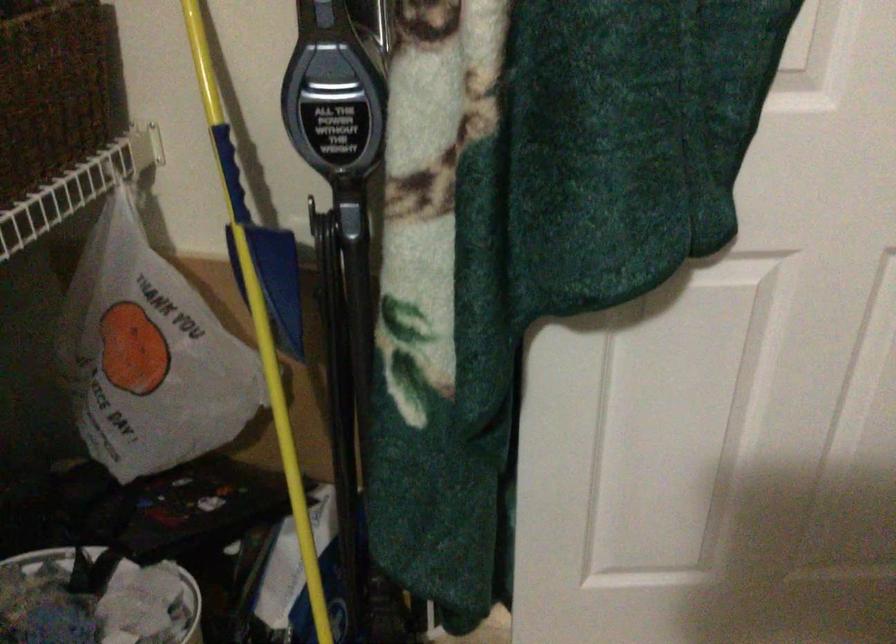
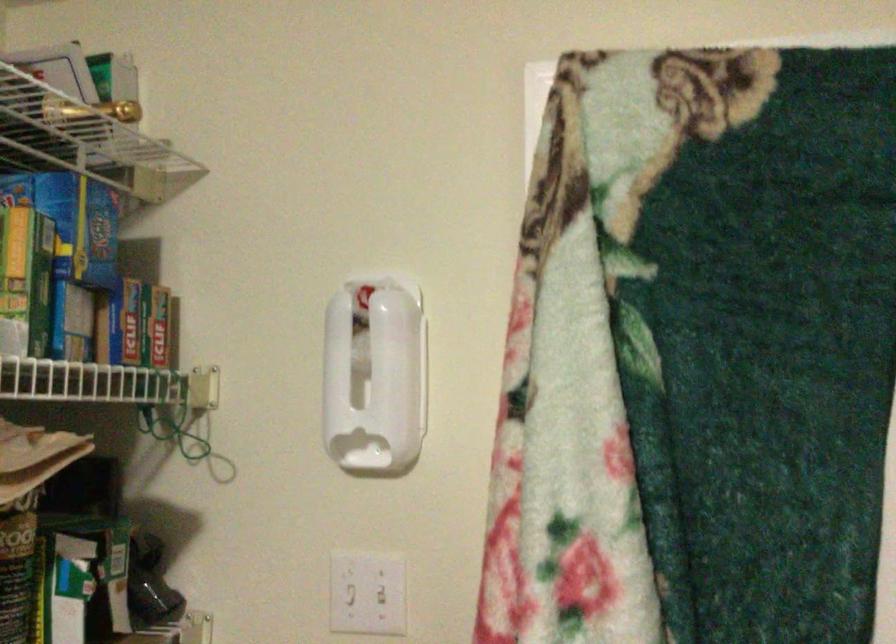
Question: How did the camera likely rotate?

Choices:
 (A) Left
 (B) Right
 (C) Up
 (D) Down

Answer: (C)